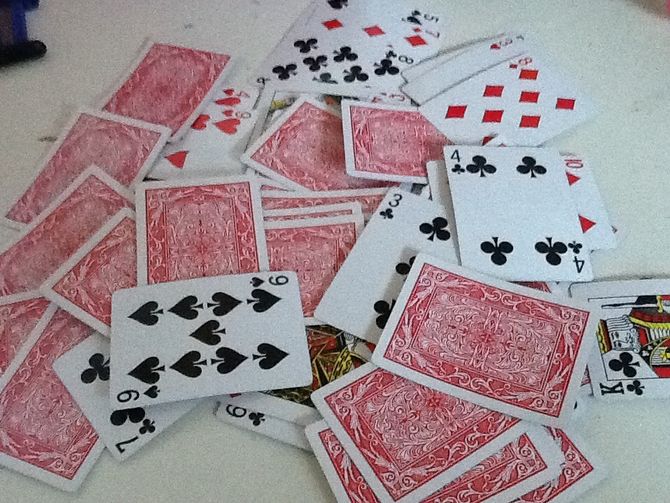
This screenshot has height=503, width=670. Identify the location of smudge on table top. (640, 105).